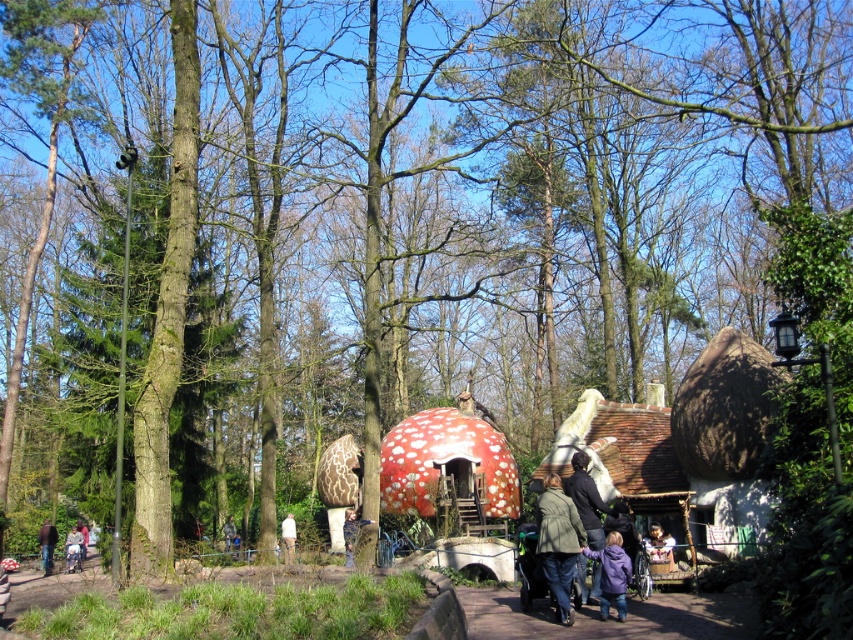
Question: From the image, what is the correct spatial relationship of dark blue jacket at center in relation to brown leather jacket at lower left?

Choices:
 (A) left
 (B) right

Answer: (B)

Question: Is brown leather jacket at center above dark brown leather jacket at lower left?

Choices:
 (A) no
 (B) yes

Answer: (B)

Question: Based on their relative distances, which object is farther from the paved stone path at center?

Choices:
 (A) purple fleece jacket at lower center
 (B) brown leather jacket at lower left
 (C) white cotton shirt at center

Answer: (B)

Question: Is paved stone path at center below white cotton shirt at center?

Choices:
 (A) yes
 (B) no

Answer: (B)

Question: Which object appears farthest from the camera in this image?

Choices:
 (A) camouflage jacket at center
 (B) dark brown leather jacket at lower left

Answer: (A)

Question: Which of these objects is positioned closest to the camouflage jacket at center?

Choices:
 (A) dark blue jacket at center
 (B) dark brown leather jacket at lower left

Answer: (B)